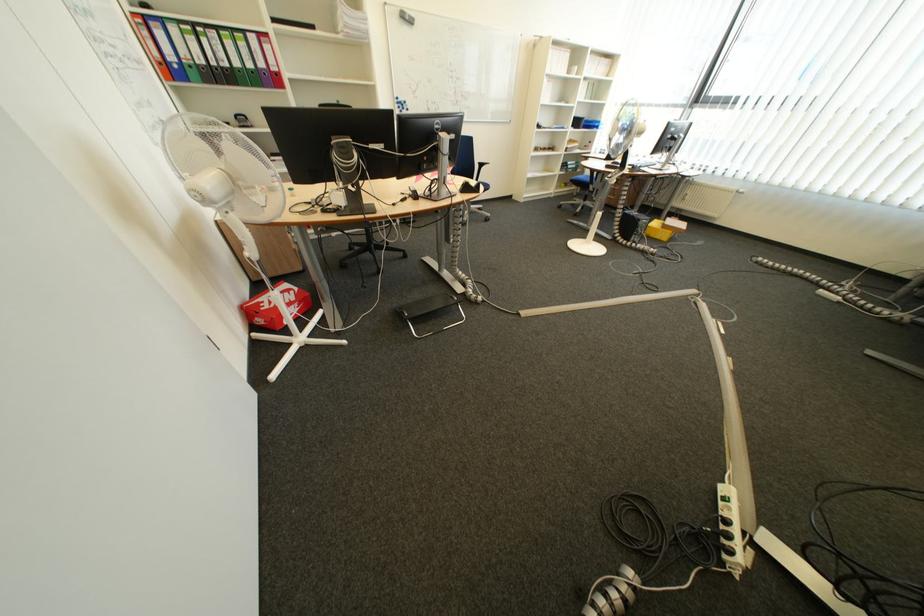
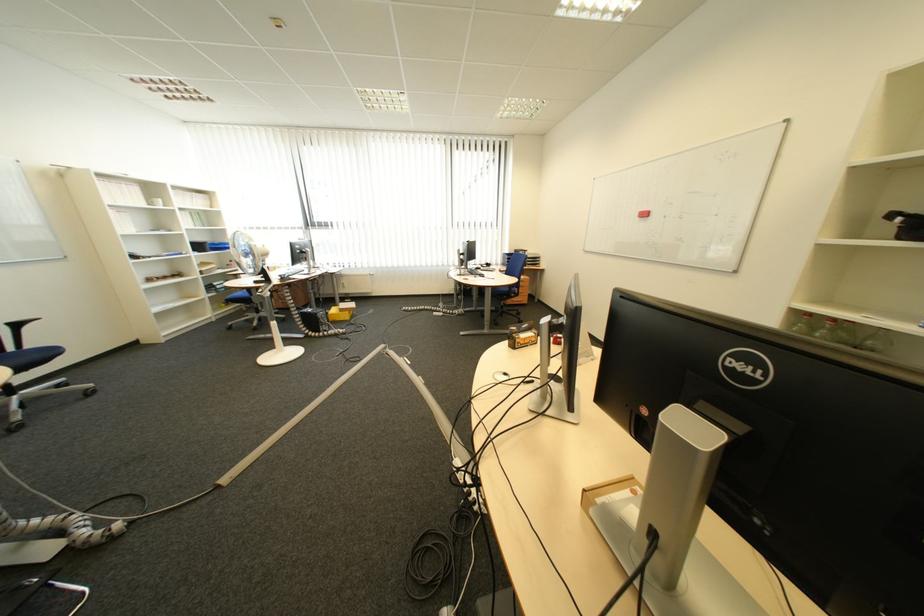
Locate, in the second image, the point that corresponds to point 578,74 in the first image.

(155, 206)